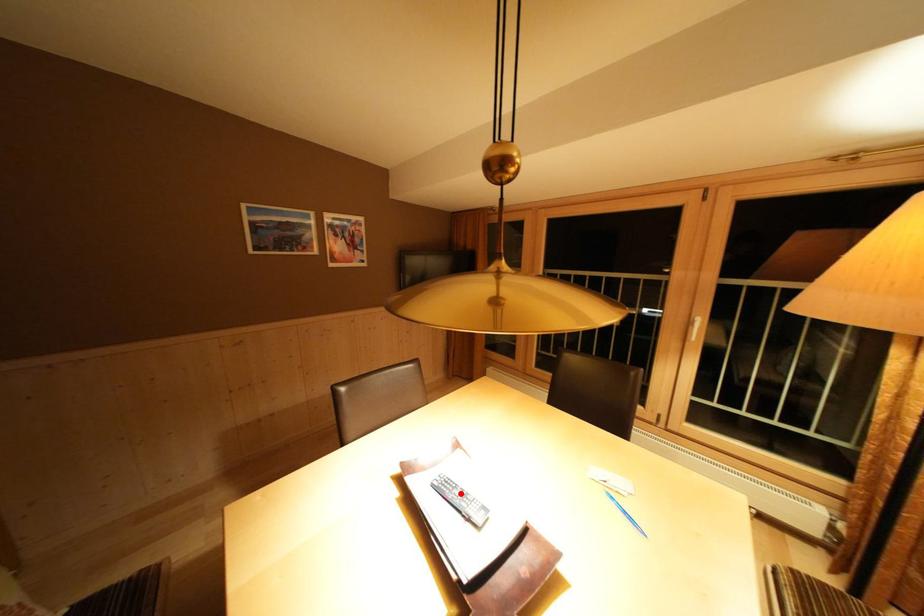
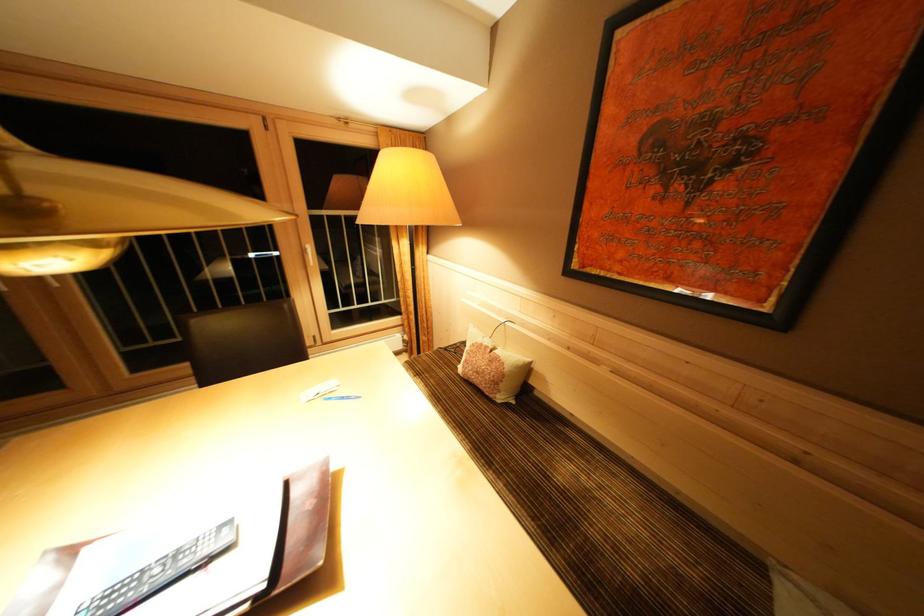
Locate, in the second image, the point that corresponds to the highlighted location in the first image.

(147, 584)